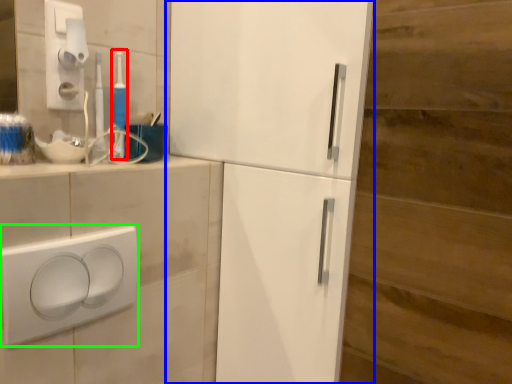
Question: Estimate the real-world distances between objects in this image. Which object is farther from toothbrush (highlighted by a red box), refrigerator (highlighted by a blue box) or light switch (highlighted by a green box)?

Choices:
 (A) refrigerator
 (B) light switch

Answer: (A)